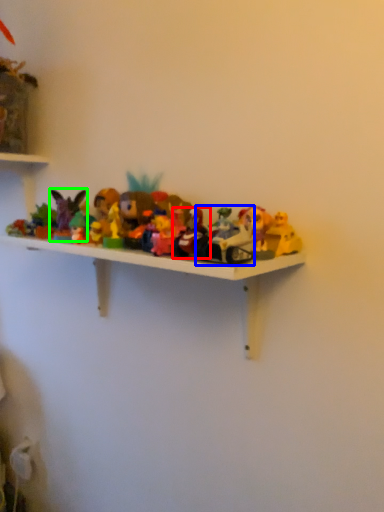
Question: Considering the real-world distances, which object is closest to toy (highlighted by a red box)? toy (highlighted by a blue box) or toy (highlighted by a green box).

Choices:
 (A) toy
 (B) toy

Answer: (A)